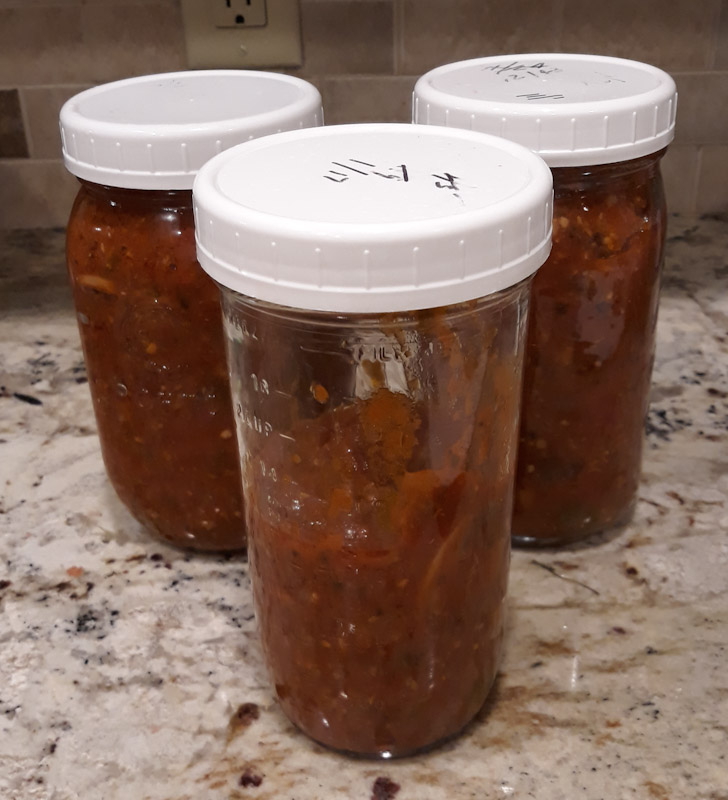
At what (x,y) coordinates should I click in order to perform the action: click on 3 glass jars. Please return your answer as a coordinate pair (x, y). The image size is (728, 800). Looking at the image, I should click on (126, 406), (546, 418), (424, 601).